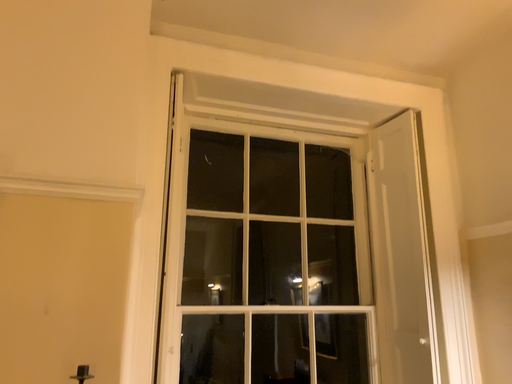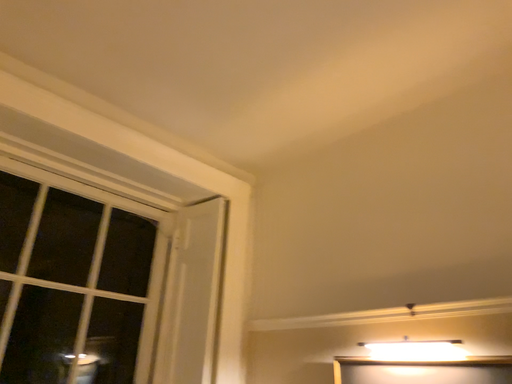
Question: Which way did the camera rotate in the video?

Choices:
 (A) rotated upward
 (B) rotated downward

Answer: (A)